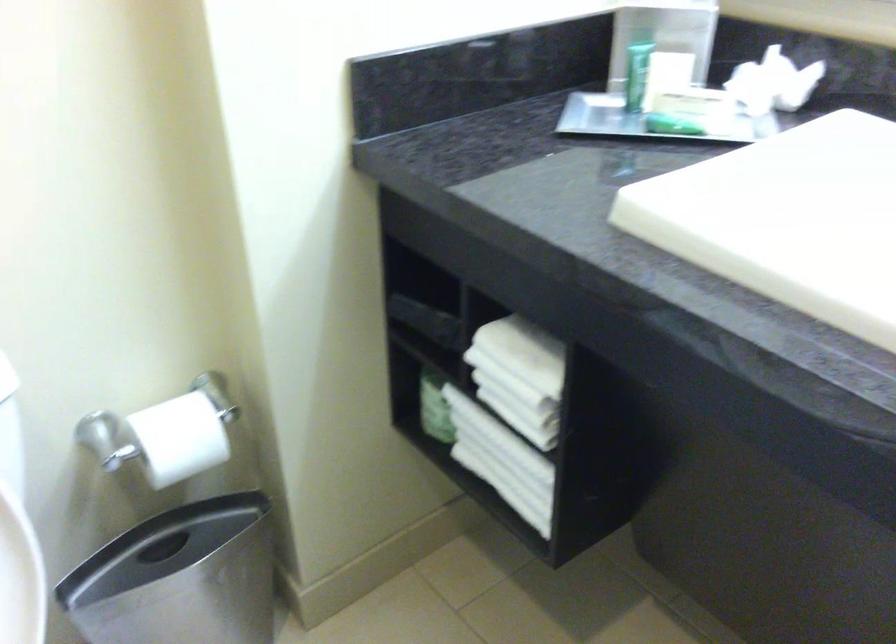
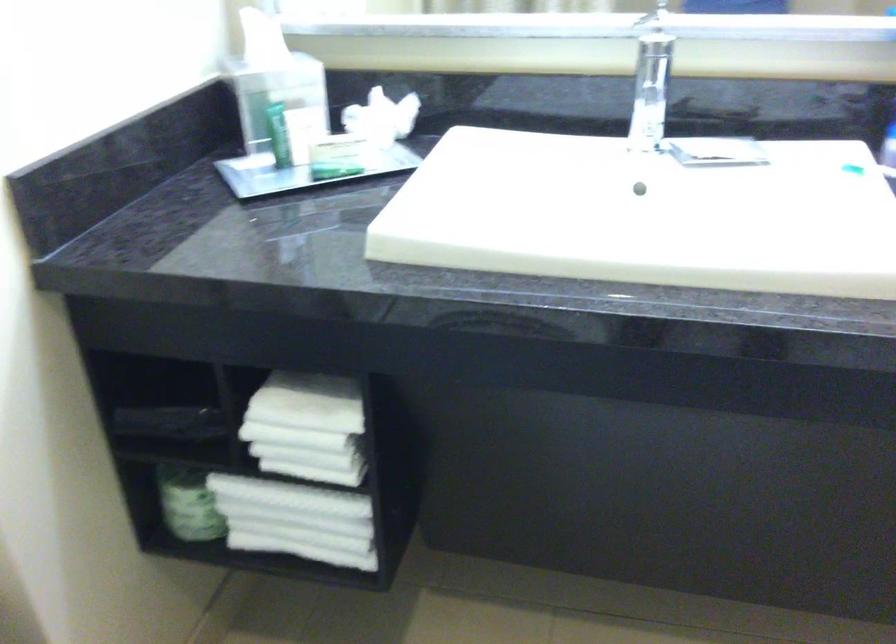
Where in the second image is the point corresponding to [763,80] from the first image?

(382, 118)